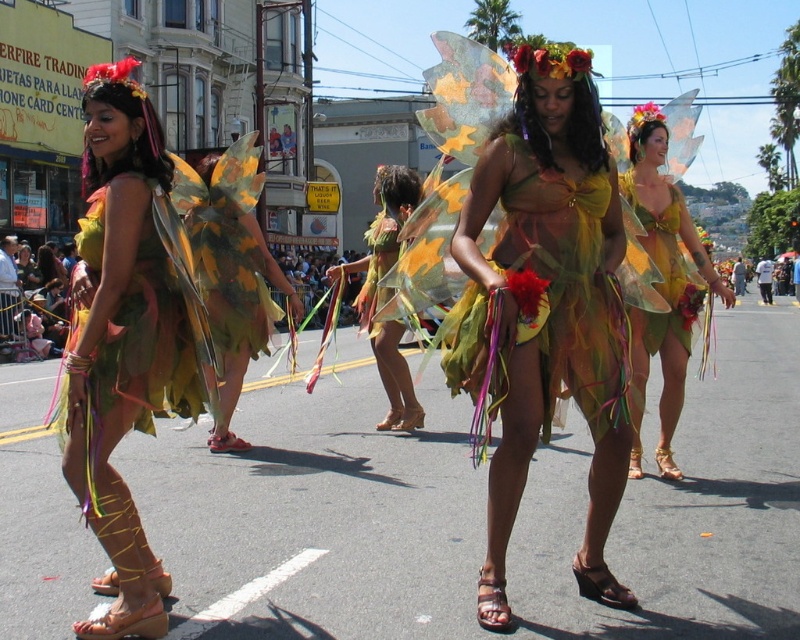
Question: Is matte green fabric dress at center to the right of multicolored fabric wings at left from the viewer's perspective?

Choices:
 (A) yes
 (B) no

Answer: (A)

Question: Which point is closer to the camera taking this photo?

Choices:
 (A) (594, 374)
 (B) (342, 273)

Answer: (A)

Question: Which object is positioned farthest from the shiny gold dress at center?

Choices:
 (A) matte yellow fairy wings at center
 (B) camouflage fabric wings at center
 (C) translucent yellow-green wings at center

Answer: (B)

Question: Does matte green leaf wings at center have a lesser width compared to matte yellow fairy wings at center?

Choices:
 (A) no
 (B) yes

Answer: (B)

Question: Which object is positioned farthest from the translucent yellow-green wings at center?

Choices:
 (A) multicolored fabric wings at left
 (B) camouflage fabric wings at center

Answer: (A)

Question: Is shiny gold dress at center wider than matte green fabric dress at center?

Choices:
 (A) no
 (B) yes

Answer: (B)